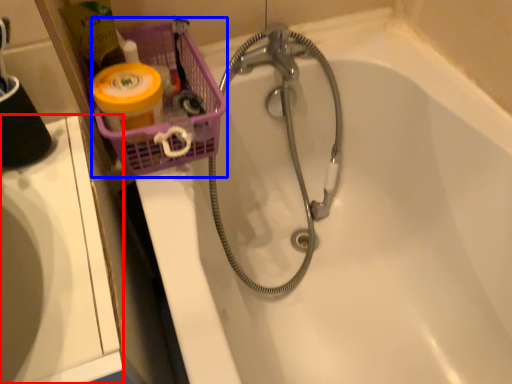
Question: Which of the following is the closest to the observer, sink (highlighted by a red box) or basket (highlighted by a blue box)?

Choices:
 (A) sink
 (B) basket

Answer: (A)